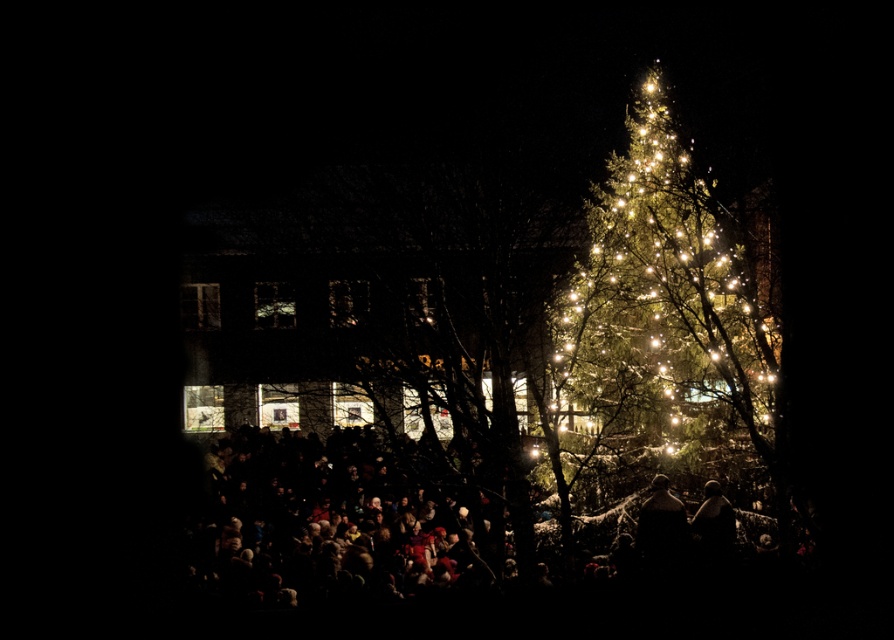
You are standing in front of the Christmas tree and notice both the illuminated green pine at right and the brown leather jacket at lower right. Which object is positioned higher in the scene?

The illuminated green pine at right is positioned higher than the brown leather jacket at lower right.

You are standing in front of the Christmas tree and want to take a photo of the illuminated green pine at right. What are the coordinates where you should focus your camera?

The illuminated green pine at right is located at coordinates point (670,300), so you should focus your camera there.